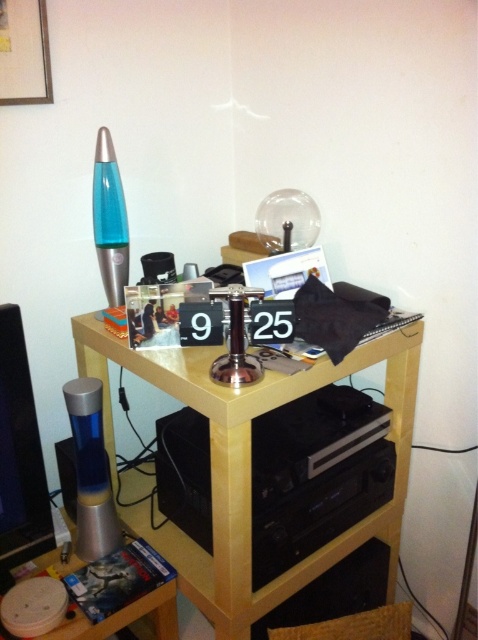
Question: Is light wood table at center smaller than black plastic stereo at center?

Choices:
 (A) yes
 (B) no

Answer: (B)

Question: Does light wood table at center have a smaller size compared to matte plastic dvd case at lower left?

Choices:
 (A) yes
 (B) no

Answer: (B)

Question: Which object is farther from the camera taking this photo?

Choices:
 (A) black plastic stereo at center
 (B) light wood table at center
 (C) matte plastic dvd case at lower left

Answer: (C)

Question: Which object appears closest to the camera in this image?

Choices:
 (A) matte plastic dvd case at lower left
 (B) light wood table at center
 (C) black plastic stereo at center

Answer: (B)

Question: Which object is closer to the camera taking this photo?

Choices:
 (A) matte plastic dvd case at lower left
 (B) black plastic stereo at center

Answer: (B)

Question: Is the position of light wood table at center more distant than that of matte plastic dvd case at lower left?

Choices:
 (A) no
 (B) yes

Answer: (A)